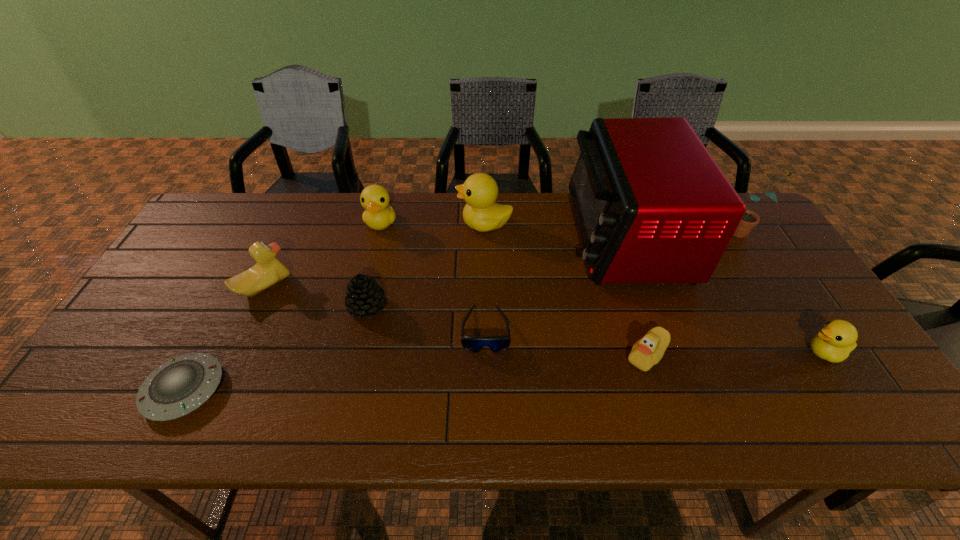
Locate an element on the screen. This screenshot has height=540, width=960. object present at the left edge is located at coordinates (179, 386).

Where is `sunflower present at the right edge`? sunflower present at the right edge is located at coordinates (750, 219).

Where is `duck that is at the right edge`? duck that is at the right edge is located at coordinates (837, 338).

Identify the location of object at the near left corner. The width and height of the screenshot is (960, 540). (179, 386).

I want to click on object positioned at the far right corner, so click(750, 219).

Locate an element on the screen. The image size is (960, 540). free space at the far edge is located at coordinates (546, 199).

Where is `blank area at the near edge`? Image resolution: width=960 pixels, height=540 pixels. blank area at the near edge is located at coordinates (477, 415).

Locate an element on the screen. Image resolution: width=960 pixels, height=540 pixels. vacant region at the left edge of the desktop is located at coordinates (213, 251).

The height and width of the screenshot is (540, 960). I want to click on free location at the right edge of the desktop, so click(x=793, y=320).

Locate an element on the screen. The height and width of the screenshot is (540, 960). free space at the far left corner of the desktop is located at coordinates (256, 193).